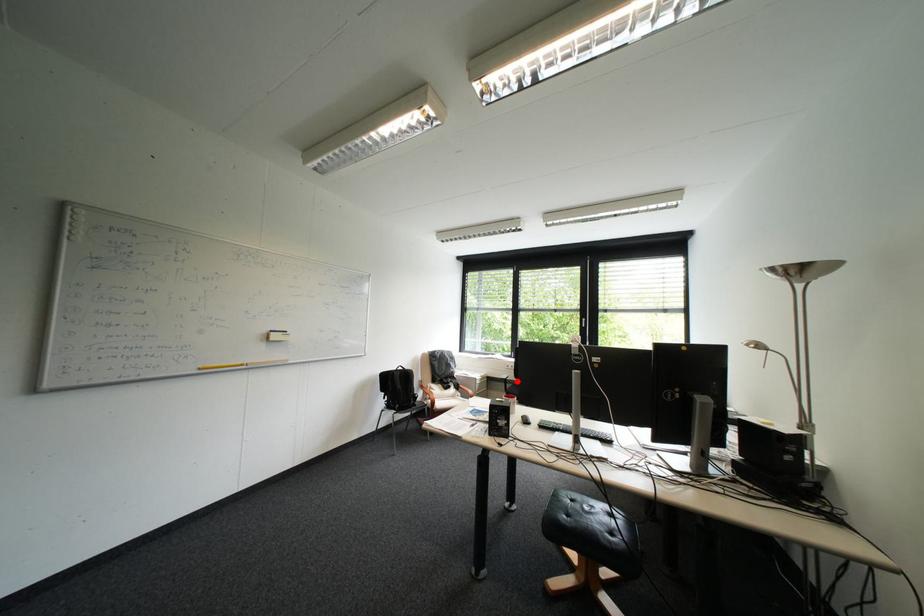
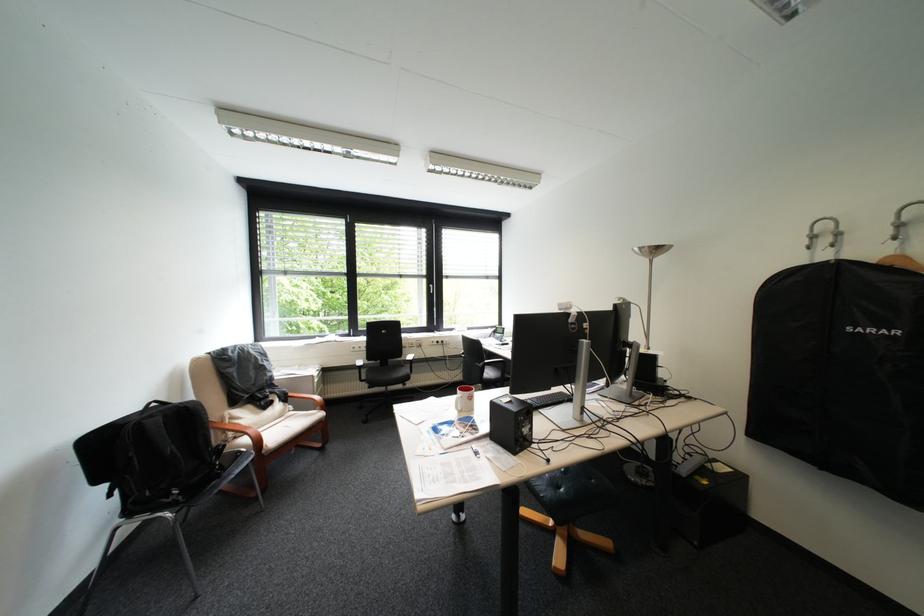
Question: I am providing you with two images of the same scene from different viewpoints. A red point is shown in image1. For the corresponding object point in image2, is it positioned nearer or farther from the camera?

Choices:
 (A) Nearer
 (B) Farther

Answer: (A)